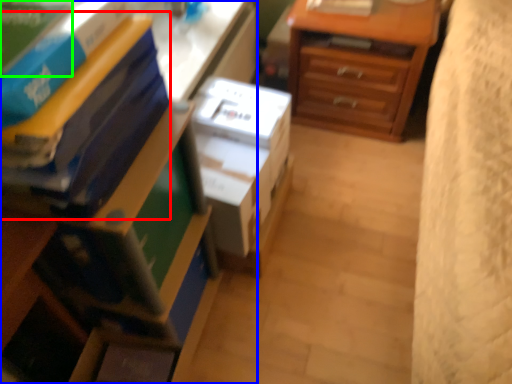
Question: Which object is positioned farthest from paperback book (highlighted by a red box)? Select from nightstand (highlighted by a blue box) and paperback book (highlighted by a green box).

Choices:
 (A) nightstand
 (B) paperback book

Answer: (B)